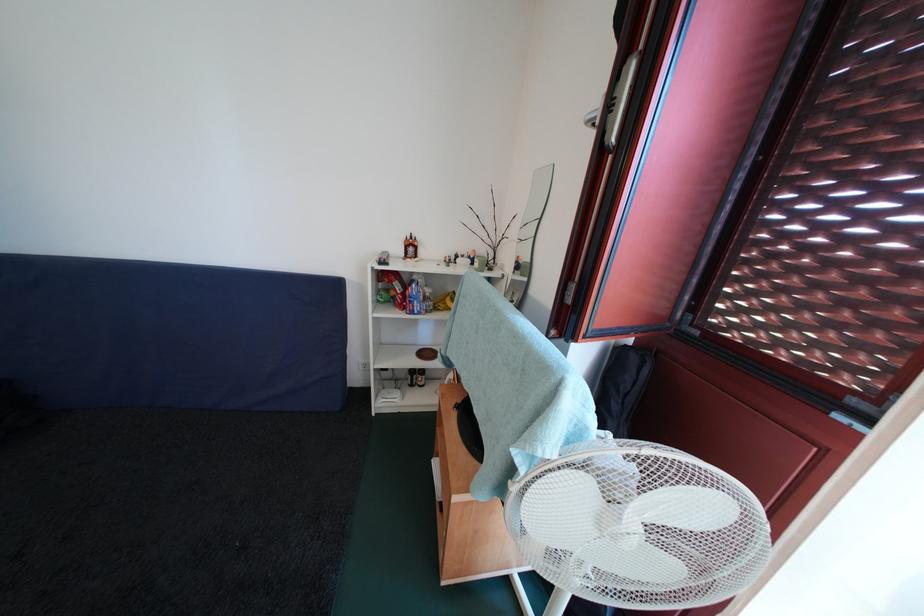
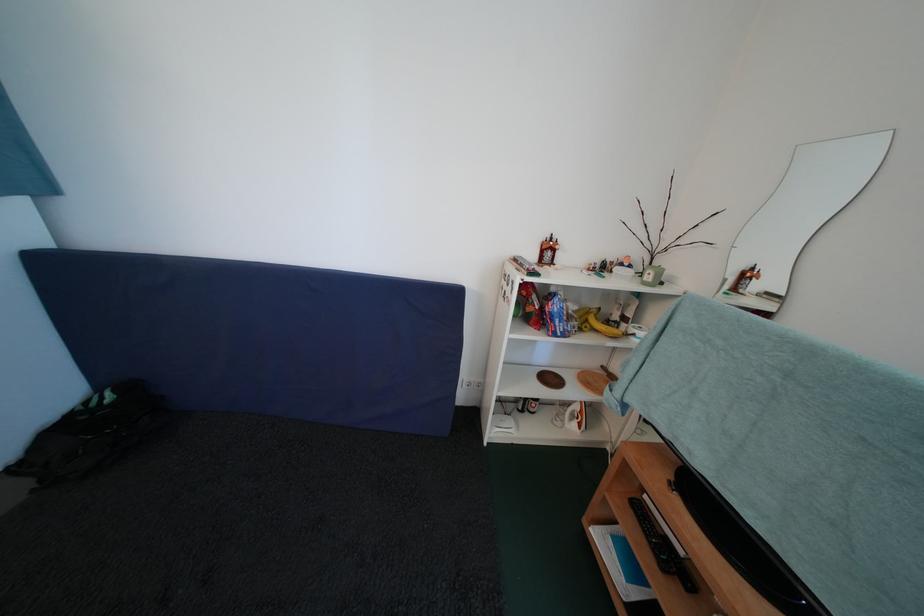
Find the pixel in the second image that matches (x=422, y=307) in the first image.

(565, 326)